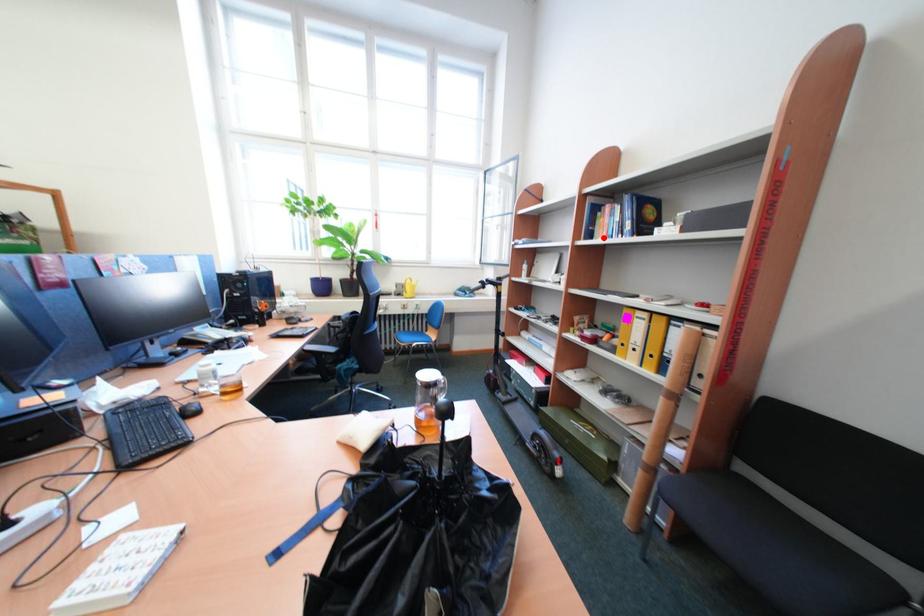
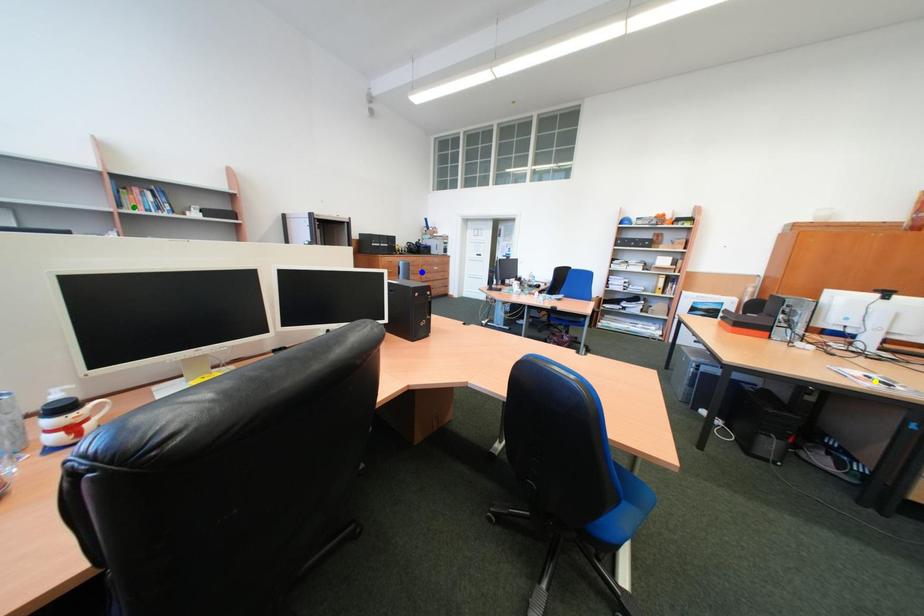
Question: I am providing you with two images of the same scene from different viewpoints. A red point is marked on the first image. You are given multiple points on the second image. Which point in image 2 is actually the same real-world point as the red point in image 1?

Choices:
 (A) yellow point
 (B) green point
 (C) blue point

Answer: (B)